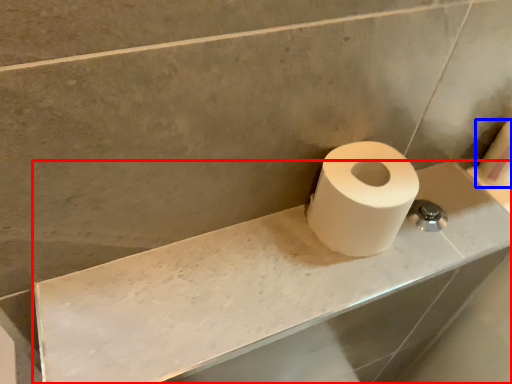
Question: Which object is closer to the camera taking this photo, counter top (highlighted by a red box) or toilet paper (highlighted by a blue box)?

Choices:
 (A) counter top
 (B) toilet paper

Answer: (A)